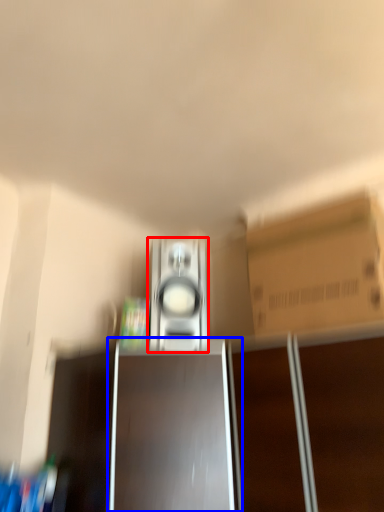
Question: Which object appears farthest to the camera in this image, home appliance (highlighted by a red box) or cabinetry (highlighted by a blue box)?

Choices:
 (A) home appliance
 (B) cabinetry

Answer: (A)